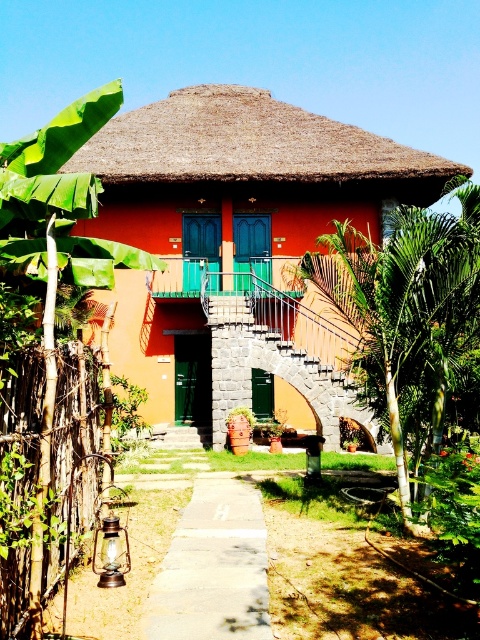
Can you confirm if matte orange hut at center is thinner than gray concrete path at center?

No, matte orange hut at center is not thinner than gray concrete path at center.

Is matte orange hut at center to the right of gray concrete path at center from the viewer's perspective?

Incorrect, matte orange hut at center is not on the right side of gray concrete path at center.

Is point (372, 440) more distant than point (215, 477)?

Yes, it is.

The width and height of the screenshot is (480, 640). In order to click on matte orange hut at center in this screenshot , I will do `click(239, 241)`.

At what (x,y) coordinates should I click in order to perform the action: click on gray concrete path at center. Please return your answer as a coordinate pair (x, y). This screenshot has height=640, width=480. Looking at the image, I should click on (214, 566).

Does gray concrete path at center have a greater height compared to stone/stucco staircase at center?

No.

Is point (166, 627) positioned in front of point (214, 449)?

Yes, point (166, 627) is in front of point (214, 449).

This screenshot has height=640, width=480. Identify the location of gray concrete path at center. (214, 566).

Between green leafy tree at center and gray concrete path at center, which one has more height?

green leafy tree at center is taller.

Is green leafy tree at center above gray concrete path at center?

Yes.

Which is behind, point (316, 266) or point (208, 472)?

The point (208, 472) is more distant.

Identify the location of green leafy tree at center. pos(406,307).